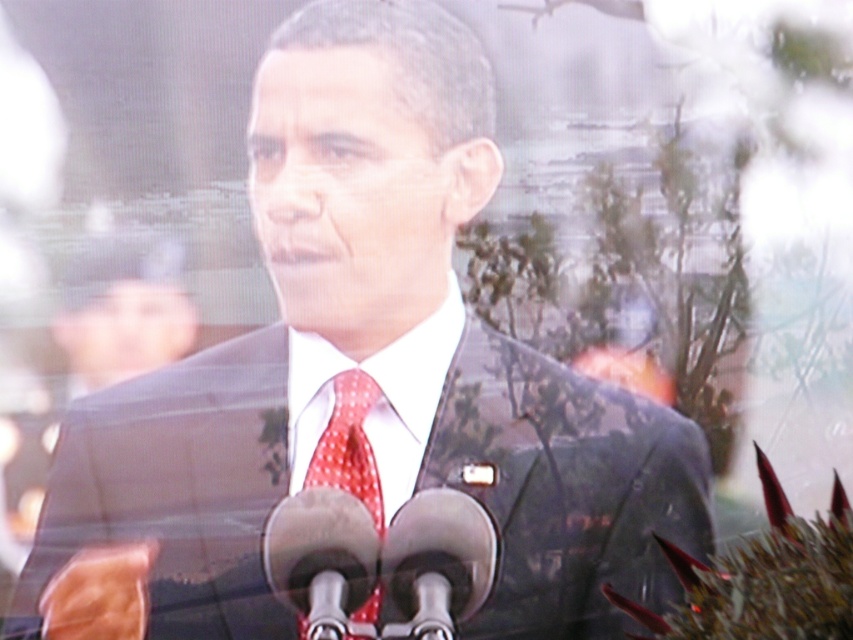
You are a photographer at a press conference. You need to capture a clear photo of both the metallic silver microphone at center and the red dotted fabric tie at center. Since the microphone is larger, which object should you focus on first to ensure both are in focus?

The metallic silver microphone at center is larger than the red dotted fabric tie at center. To ensure both are in focus, you should focus on the metallic silver microphone at center first, as it requires more precise focus due to its size.

You are a photographer at a press conference and need to adjust the lighting so that the metallic silver microphone at center and the red dotted fabric tie at center are both well lit. Since the microphone is to the right of the tie, where should you position the light source relative to the speaker?

The metallic silver microphone at center is to the right of the red dotted fabric tie at center, so positioning the light source to the right of the speaker would ensure both the microphone and tie are well lit.

In the scene shown: You are a photographer positioned at the center of the stage. You need to capture a photo of the metallic silver microphone at center. Where should you aim your camera to ensure the microphone is in the frame?

You should aim your camera at the point (380, 561) to capture the metallic silver microphone at center in the frame.